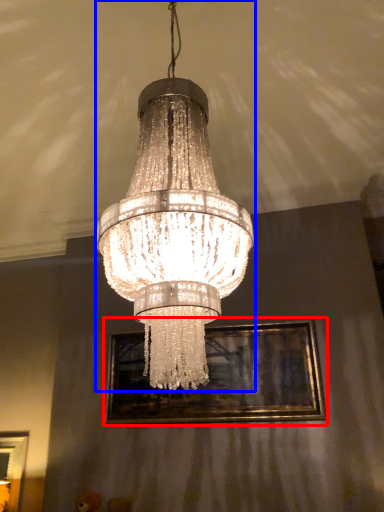
Question: Which point is further to the camera, picture frame (highlighted by a red box) or lamp (highlighted by a blue box)?

Choices:
 (A) picture frame
 (B) lamp

Answer: (A)